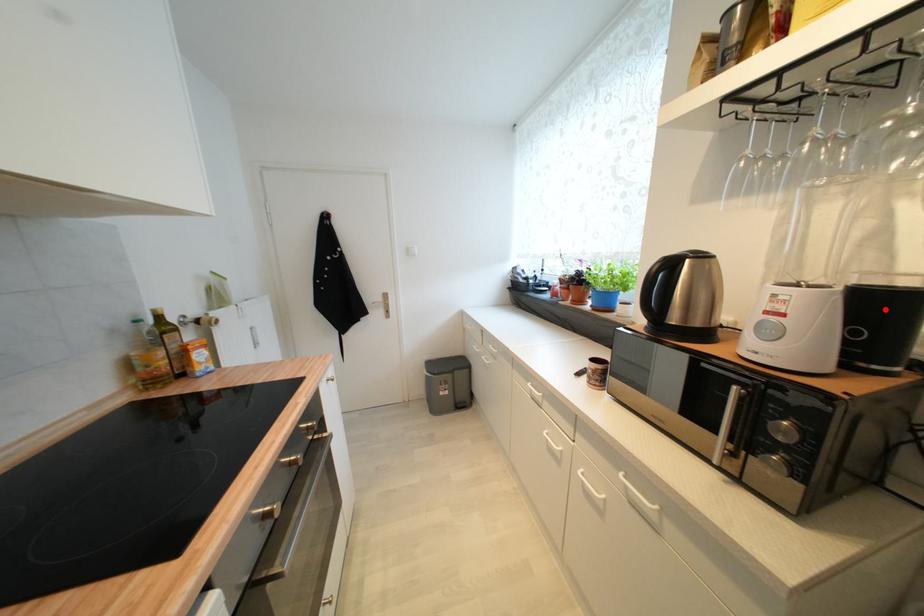
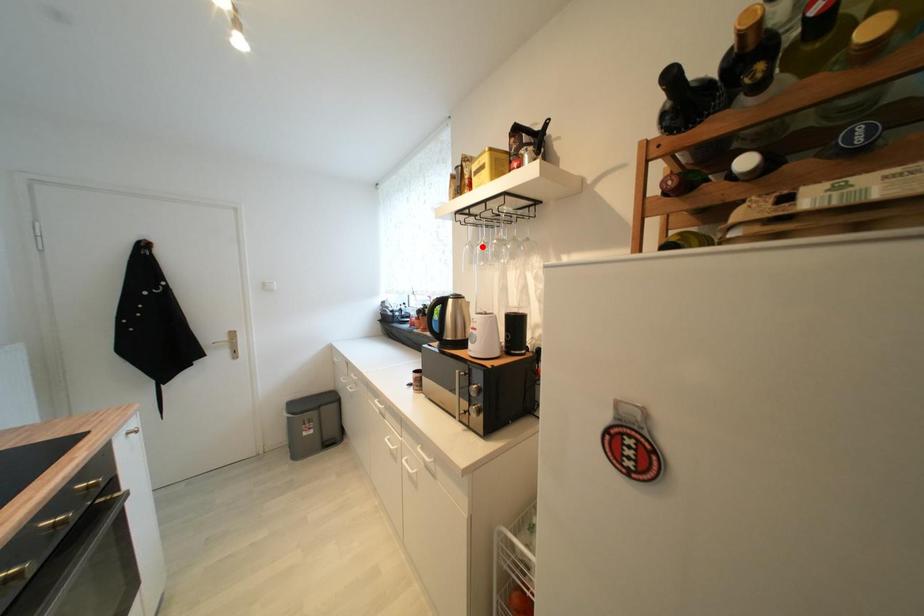
I am providing you with two images of the same scene from different viewpoints. A red point is marked on the first image and another point is marked on the second image. Is the red point in image1 aligned with the point shown in image2?

No